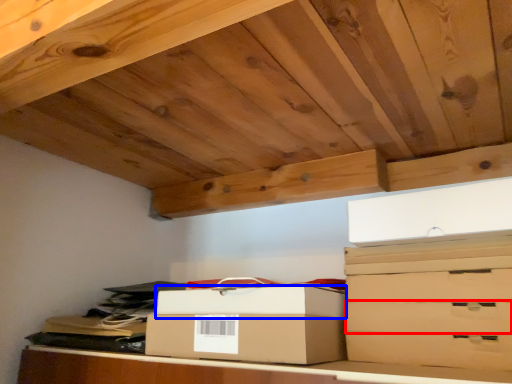
Question: Among these objects, which one is farthest to the camera, drawer (highlighted by a red box) or box (highlighted by a blue box)?

Choices:
 (A) drawer
 (B) box

Answer: (B)